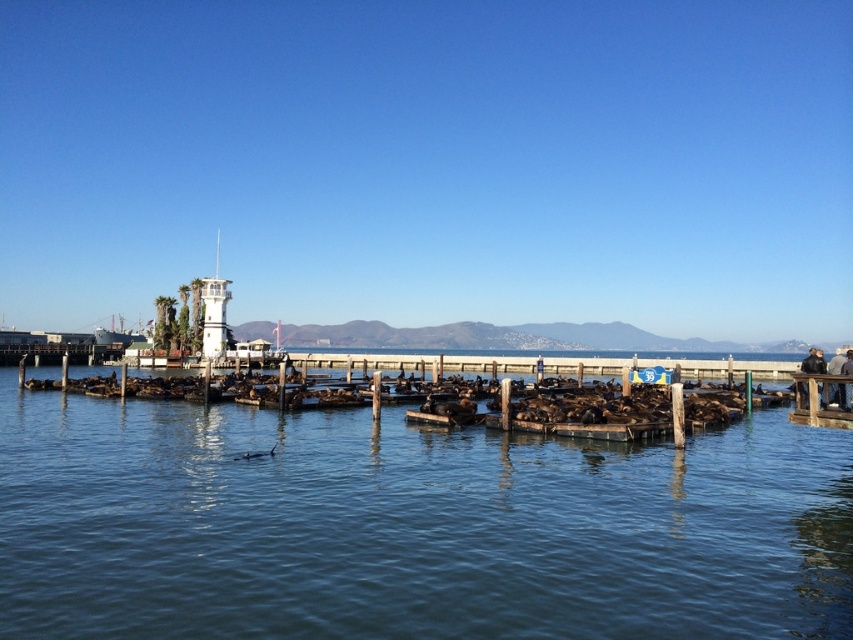
Question: Does clear blue water at center have a smaller size compared to wooden dock at right?

Choices:
 (A) yes
 (B) no

Answer: (A)

Question: Does white plastic tower at center appear over black leather jacket at lower right?

Choices:
 (A) yes
 (B) no

Answer: (A)

Question: Which point is farther to the camera?

Choices:
 (A) (561, 624)
 (B) (811, 376)
 (C) (216, 268)
 (D) (821, 356)

Answer: (C)

Question: Which object is positioned closest to the black leather jacket at lower right?

Choices:
 (A) white plastic tower at center
 (B) wooden dock at right

Answer: (B)

Question: Which object appears farthest from the camera in this image?

Choices:
 (A) white plastic tower at center
 (B) wooden dock at right

Answer: (A)

Question: Can you confirm if clear blue water at center is positioned to the left of black leather jacket at lower right?

Choices:
 (A) no
 (B) yes

Answer: (B)